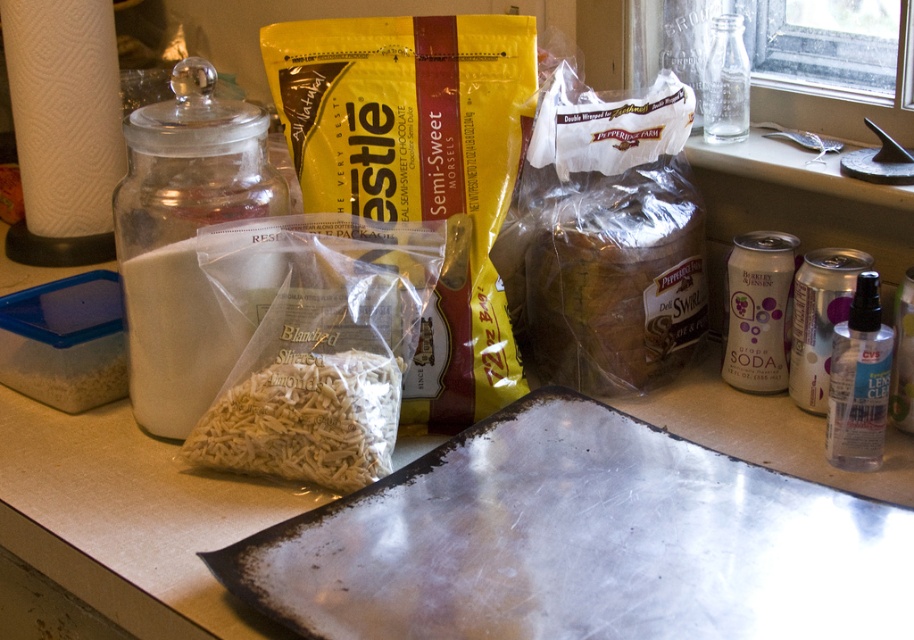
Question: Is metallic silver baking sheet at lower center wider than white powder at left?

Choices:
 (A) yes
 (B) no

Answer: (A)

Question: Can you confirm if white textured shredded mozzarella at center is bigger than white powder at left?

Choices:
 (A) yes
 (B) no

Answer: (B)

Question: Considering the real-world distances, which object is farthest from the white powder at left?

Choices:
 (A) metallic silver baking sheet at lower center
 (B) white textured shredded mozzarella at center

Answer: (A)

Question: Among these objects, which one is farthest from the camera?

Choices:
 (A) white powder at left
 (B) metallic silver baking sheet at lower center

Answer: (A)

Question: Is metallic silver baking sheet at lower center to the left of white textured shredded mozzarella at center from the viewer's perspective?

Choices:
 (A) no
 (B) yes

Answer: (A)

Question: Which of the following is the closest to the observer?

Choices:
 (A) metallic silver baking sheet at lower center
 (B) white textured shredded mozzarella at center

Answer: (A)